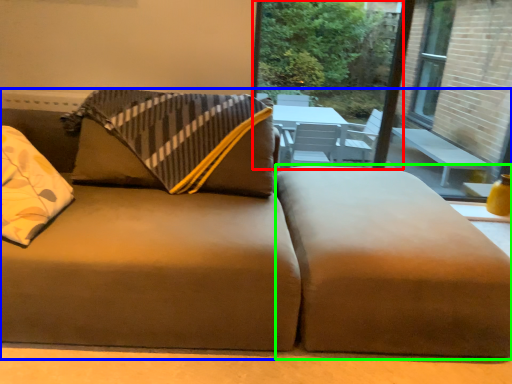
Question: Which object is the farthest from window screen (highlighted by a red box)? Choose among these: studio couch (highlighted by a blue box) or footrest (highlighted by a green box).

Choices:
 (A) studio couch
 (B) footrest

Answer: (B)